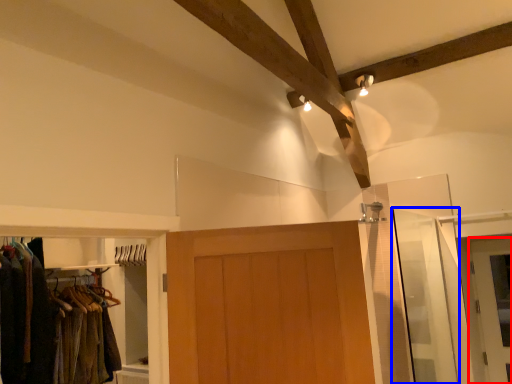
Question: Among these objects, which one is nearest to the camera, door (highlighted by a red box) or screen door (highlighted by a blue box)?

Choices:
 (A) door
 (B) screen door

Answer: (B)